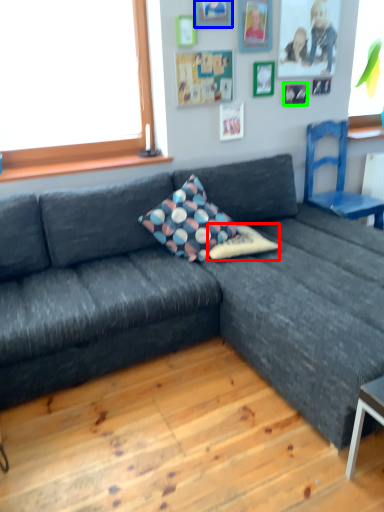
Question: Which is nearer to the pillow (highlighted by a red box)? picture frame (highlighted by a blue box) or picture frame (highlighted by a green box).

Choices:
 (A) picture frame
 (B) picture frame

Answer: (B)